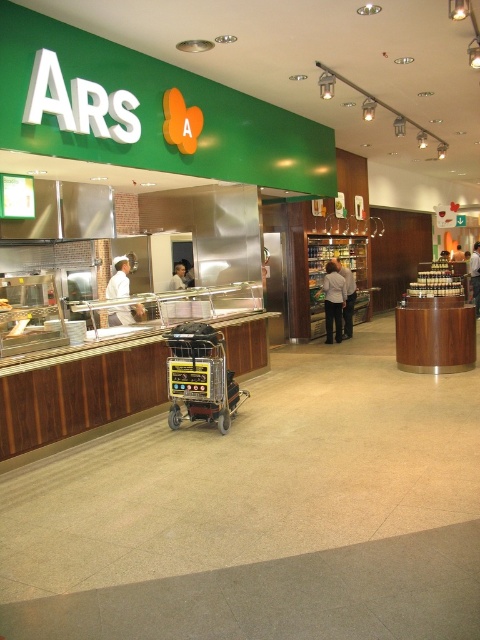
Which is above, white shirt at center or white uniform at center?

white shirt at center

Is the position of white shirt at center more distant than that of white uniform at center?

Yes, white shirt at center is behind white uniform at center.

What do you see at coordinates (334, 301) in the screenshot? I see `white shirt at center` at bounding box center [334, 301].

I want to click on white shirt at center, so click(334, 301).

Who is positioned more to the right, white shirt at center or white fabric person at center?

white fabric person at center is more to the right.

From the picture: Measure the distance from white shirt at center to white fabric person at center.

white shirt at center is 5.07 meters from white fabric person at center.

Is point (339, 326) positioned before point (471, 285)?

Yes, it is.

Locate an element on the screen. white shirt at center is located at coordinates (334, 301).

Which is more to the right, white uniform at center or white matte person at center?

white matte person at center is more to the right.

Between point (107, 291) and point (180, 276), which one is positioned in front?

Point (107, 291) is in front.

Describe the element at coordinates (119, 278) in the screenshot. The width and height of the screenshot is (480, 640). I see `white uniform at center` at that location.

Locate an element on the screen. white uniform at center is located at coordinates (119, 278).